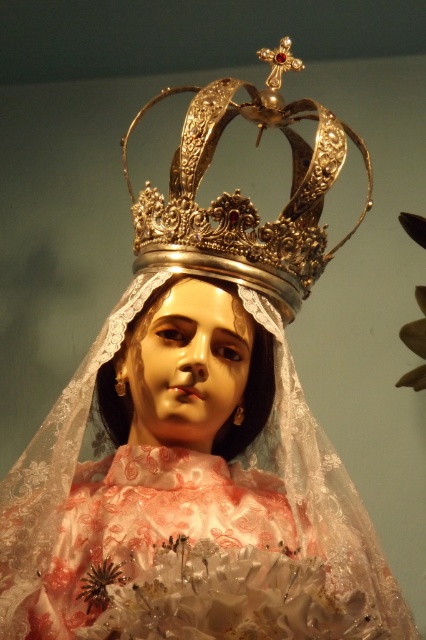
Can you confirm if gold metallic crown at upper center is positioned below matte porcelain head at center?

No, gold metallic crown at upper center is not below matte porcelain head at center.

Measure the distance between gold metallic crown at upper center and camera.

A distance of 5.28 feet exists between gold metallic crown at upper center and camera.

Find the location of a particular element. gold metallic crown at upper center is located at coordinates (242, 196).